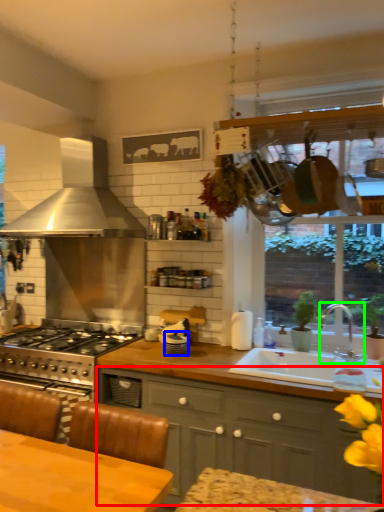
Question: Which object is positioned closest to cabinetry (highlighted by a red box)? Select from appliance (highlighted by a blue box) and tap (highlighted by a green box).

Choices:
 (A) appliance
 (B) tap

Answer: (A)